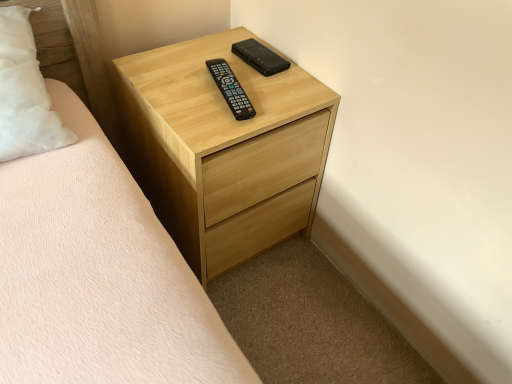
Find the location of a particular element. This screenshot has height=384, width=512. free space to the left of black matte phone at upper center, acting as the 1th control starting from the back is located at coordinates (198, 64).